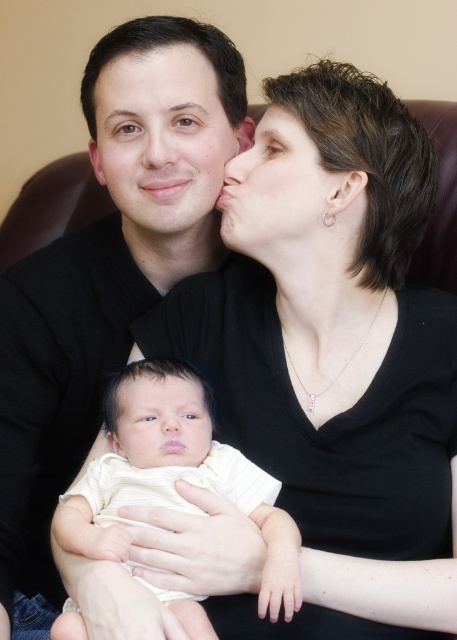
Question: Can you confirm if yellow striped fabric baby at center is positioned to the left of matte black hair at center?

Choices:
 (A) no
 (B) yes

Answer: (B)

Question: Can you confirm if matte black shirt at center is positioned to the left of matte skin forehead at upper center?

Choices:
 (A) no
 (B) yes

Answer: (B)

Question: Which point appears farthest from the camera in this image?

Choices:
 (A) (186, 193)
 (B) (198, 88)
 (C) (138, 429)

Answer: (A)

Question: Observing the image, what is the correct spatial positioning of matte black shirt at center in reference to matte black hair at center?

Choices:
 (A) above
 (B) below

Answer: (B)

Question: Which point is farther to the camera?

Choices:
 (A) (181, 403)
 (B) (190, 108)
 (C) (76, 248)
 (D) (185, 131)

Answer: (C)

Question: Which of the following is the closest to the observer?

Choices:
 (A) (295, 544)
 (B) (127, 170)
 (C) (324, 240)

Answer: (A)